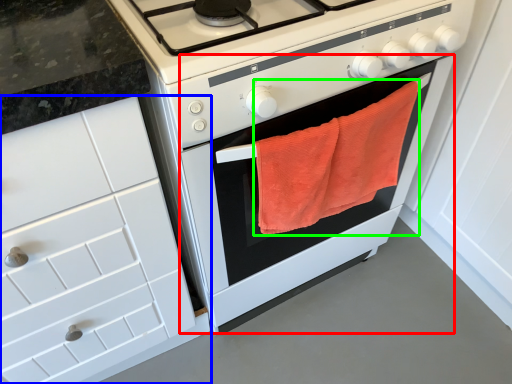
Question: Considering the real-world distances, which object is farthest from oven (highlighted by a red box)? cabinetry (highlighted by a blue box) or beach towel (highlighted by a green box)?

Choices:
 (A) cabinetry
 (B) beach towel

Answer: (A)